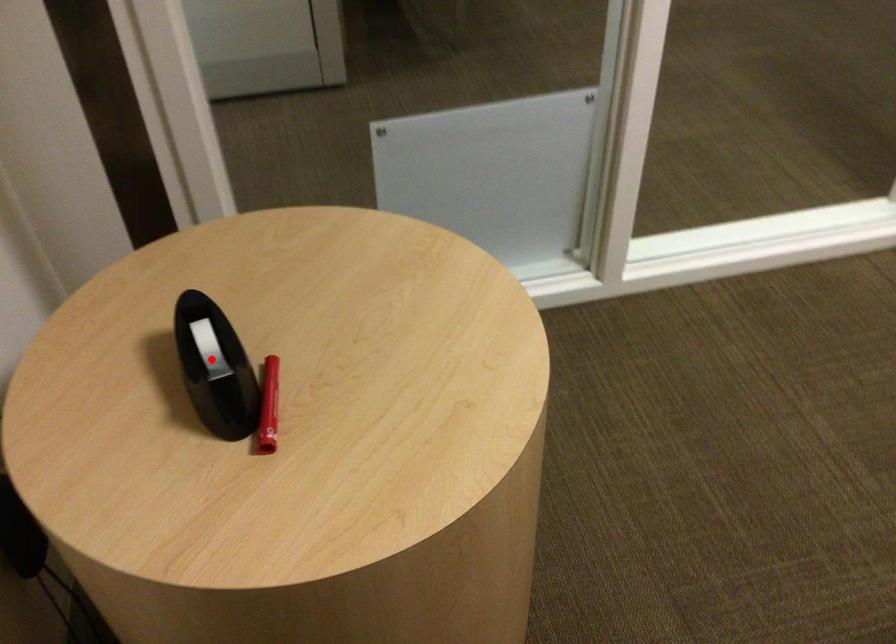
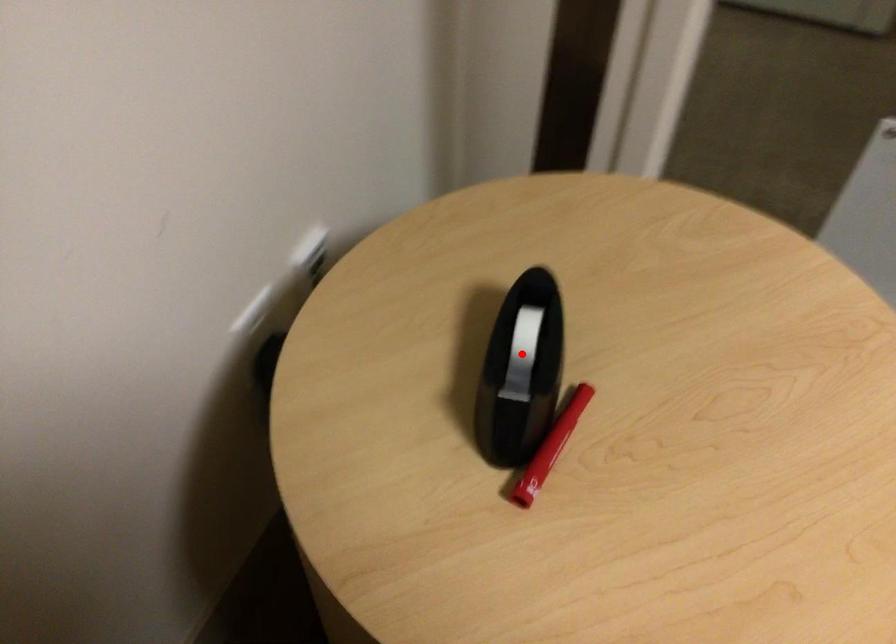
I am providing you with two images of the same scene from different viewpoints. A red point is marked on the first image and another point is marked on the second image. Does the point marked in image1 correspond to the same location as the one in image2?

Yes